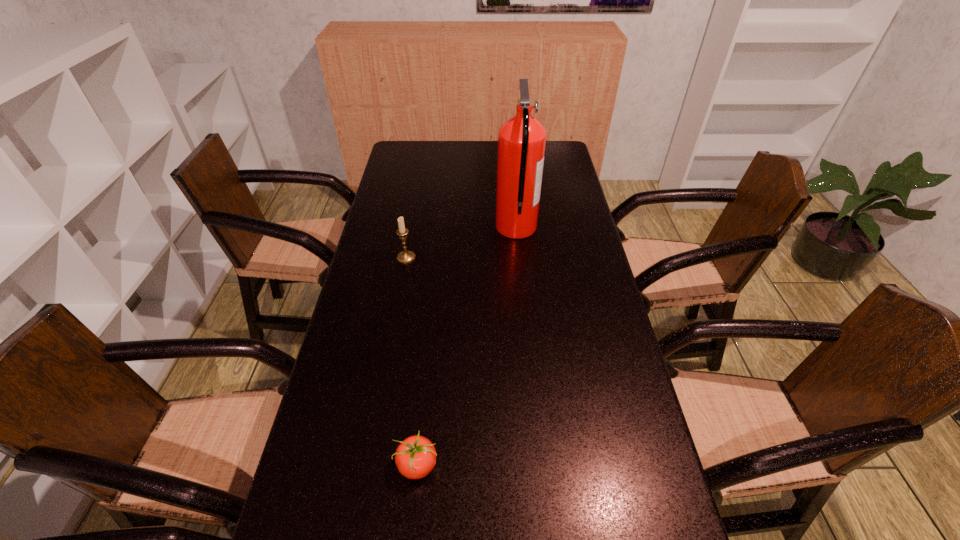
This screenshot has height=540, width=960. Identify the location of free region located 0.090m on the back of the nearest object. [x=423, y=408].

You are a GUI agent. You are given a task and a screenshot of the screen. Output one action in this format:
    pyautogui.click(x=<x>, y=<y>)
    Task: Click on the object that is at the left edge
    The width and height of the screenshot is (960, 540).
    Given the screenshot: What is the action you would take?
    pyautogui.click(x=405, y=256)

The height and width of the screenshot is (540, 960). Identify the location of blank space at the far edge of the desktop. (469, 151).

You are a GUI agent. You are given a task and a screenshot of the screen. Output one action in this format:
    pyautogui.click(x=<x>, y=<y>)
    Task: Click on the free location at the left edge of the desktop
    The width and height of the screenshot is (960, 540).
    Given the screenshot: What is the action you would take?
    pyautogui.click(x=383, y=323)

Find the location of `free space at the right edge`. free space at the right edge is located at coordinates (559, 179).

The height and width of the screenshot is (540, 960). In the image, there is a desktop. Identify the location of vacant space at the far left corner. (428, 144).

The width and height of the screenshot is (960, 540). What are the coordinates of `free space at the far right corner of the desktop` in the screenshot? It's located at (557, 151).

The height and width of the screenshot is (540, 960). I want to click on free space between the candle holder and the second object from right to left, so click(x=412, y=361).

Find the location of a particular element. The image size is (960, 540). vacant area that lies between the shortest object and the second shortest object is located at coordinates 412,361.

Find the location of `free spot between the rightmost object and the second object from right to left`. free spot between the rightmost object and the second object from right to left is located at coordinates 467,347.